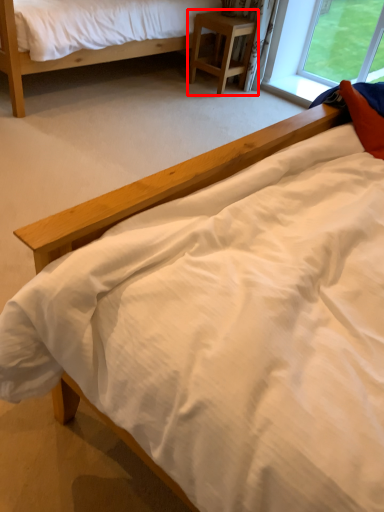
Question: In this image, where is nightstand (annotated by the red box) located relative to bed?

Choices:
 (A) right
 (B) left

Answer: (A)